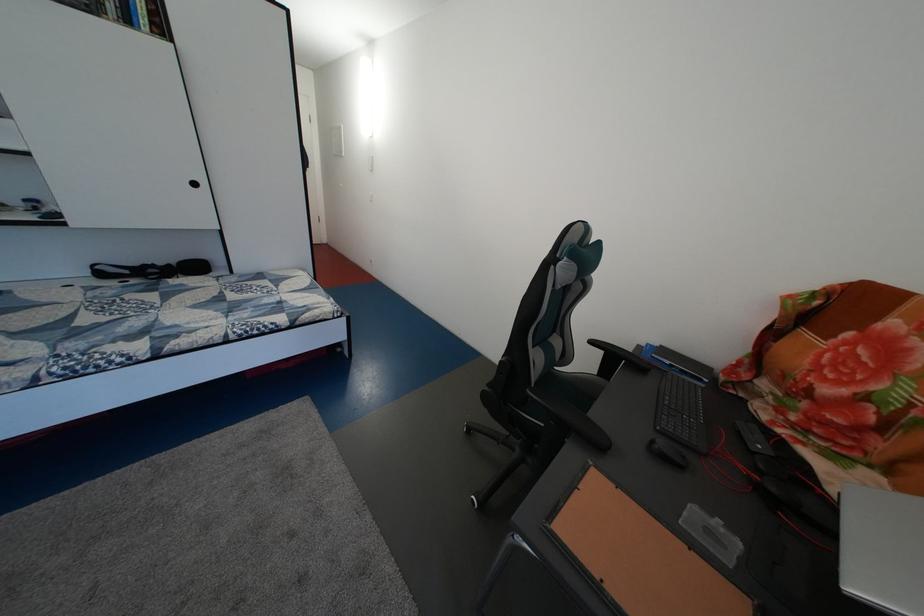
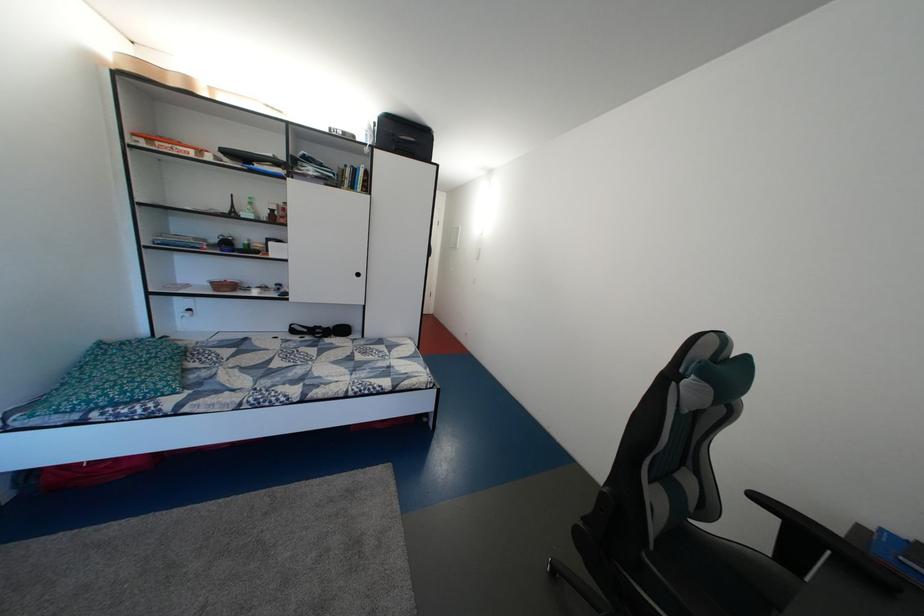
Find the pixel in the second image that matches pixel 603 349 in the first image.

(768, 504)